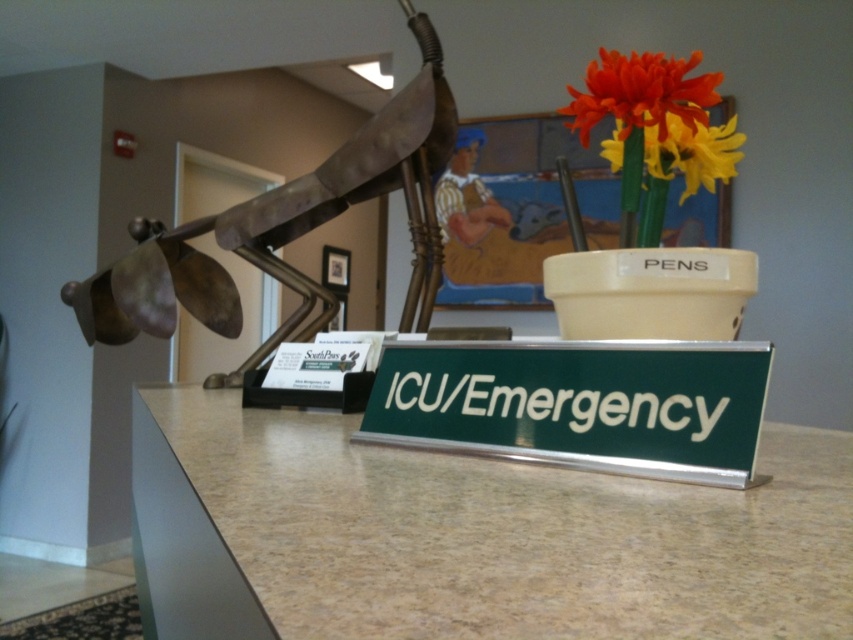
You are a maintenance worker needing to replace a broken object. You have a replacement item that is 1 meter wide. Which object from the green metallic sign at center and the white matte vase at center can you replace if the replacement fits exactly in width?

The green metallic sign at center might be wider than white matte vase at center, so the replacement item that is 1 meter wide can be used to replace the green metallic sign at center if its width matches exactly.

You are a patient who just entered the reception area and need to locate the ICU. You see the metallic sculpture at center and vibrant plastic flowers at upper right. Which object is closer to the ICU sign?

The metallic sculpture at center is closer to the ICU sign because it is placed to the left of the sign, while the vibrant plastic flowers at upper right are behind the sign.

You are standing in the reception area and want to place a new potted plant exactly where the metallic sculpture at center is currently located. Is this possible given their current positions?

The metallic sculpture at center is located at point (281, 228), so yes, you can place the new potted plant there since it is an empty space.